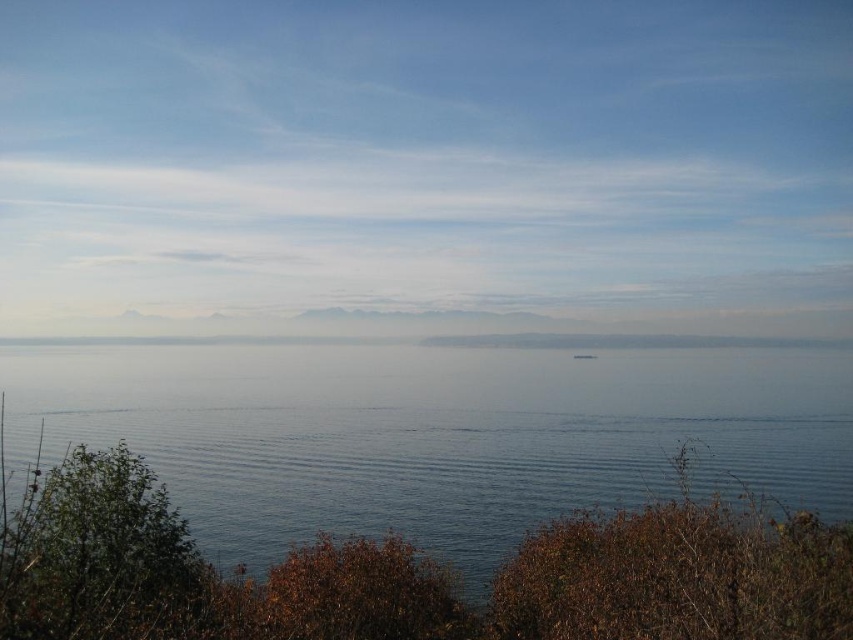
Which is above, transparent water at center or white plastic boat at center?

white plastic boat at center is above.

Locate an element on the screen. The image size is (853, 640). transparent water at center is located at coordinates (436, 435).

Identify the location of transparent water at center. (436, 435).